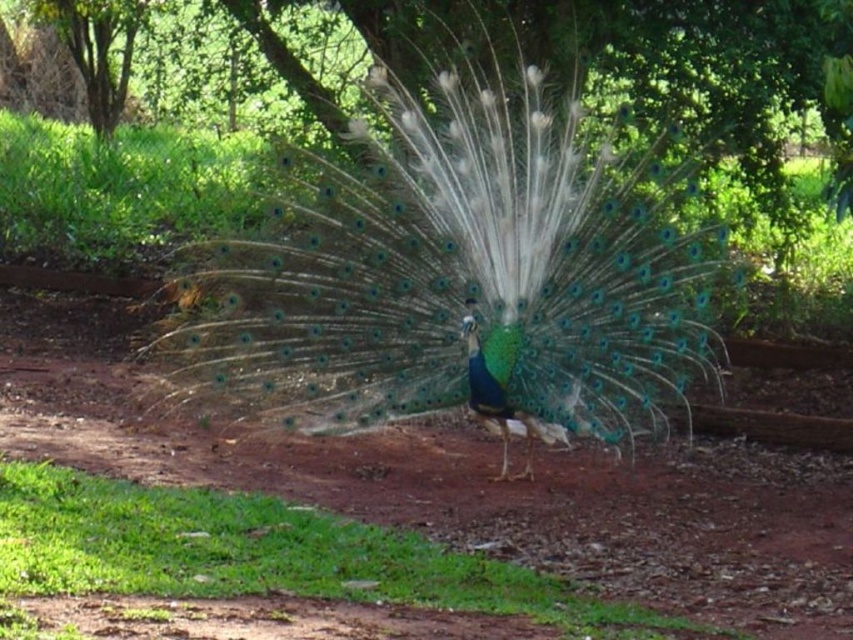
Question: Among these objects, which one is farthest from the camera?

Choices:
 (A) green grass at lower left
 (B) shiny iridescent peacock at center

Answer: (B)

Question: Does shiny iridescent peacock at center have a smaller size compared to green grass at lower left?

Choices:
 (A) yes
 (B) no

Answer: (B)

Question: In this image, where is shiny iridescent peacock at center located relative to green grass at lower left?

Choices:
 (A) below
 (B) above

Answer: (B)

Question: Which point is closer to the camera?

Choices:
 (A) green grass at lower left
 (B) shiny iridescent peacock at center

Answer: (A)

Question: Which point is closer to the camera?

Choices:
 (A) shiny iridescent peacock at center
 (B) green grass at lower left

Answer: (B)

Question: Observing the image, what is the correct spatial positioning of shiny iridescent peacock at center in reference to green grass at lower left?

Choices:
 (A) below
 (B) above

Answer: (B)